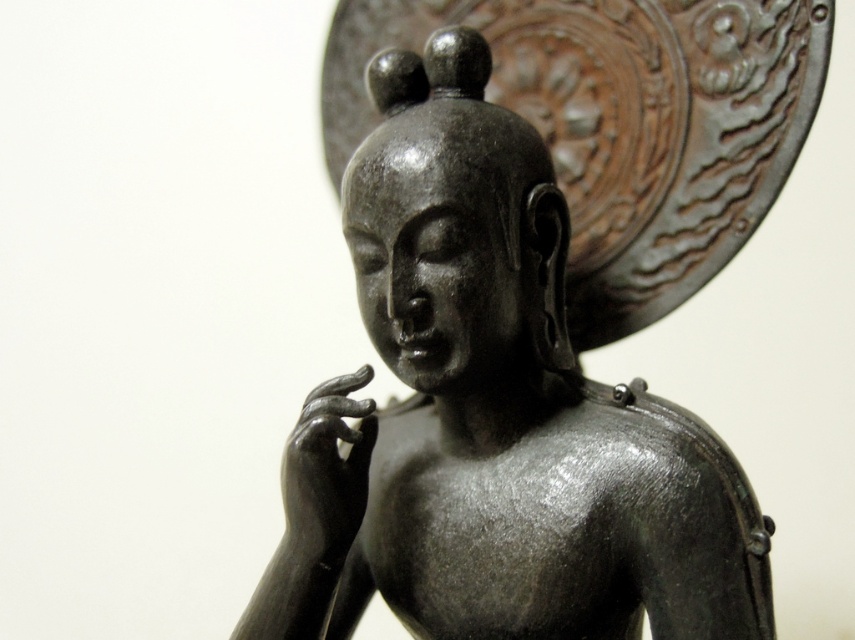
You are an art conservator examining the statue and the hand in the image. Which object would you need to move first to access the area behind both the matte black statue at center and the matte black hand at center?

The matte black statue at center is in front of the matte black hand at center, so you would need to move the matte black statue at center first to access the area behind both.

You are an art conservator examining the statue. You need to determine if the matte black hand at center is part of the matte black statue at center. Based on their sizes, can you conclude this?

The matte black statue at center is taller than the matte black hand at center, which suggests that the hand is likely a part of the statue since it is smaller and positioned at the center.